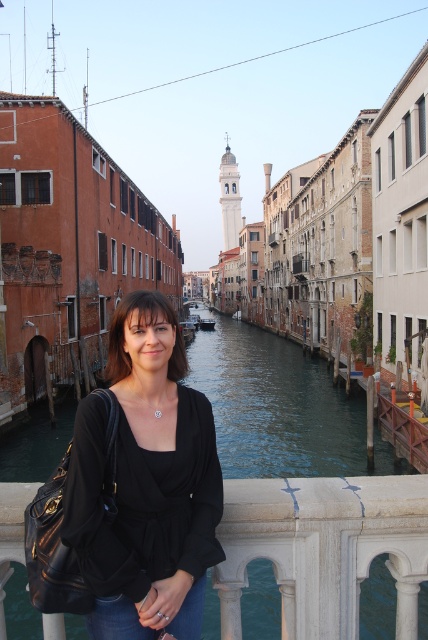
Does black matte shirt at center have a lesser height compared to jeans at lower center?

In fact, black matte shirt at center may be taller than jeans at lower center.

What do you see at coordinates (145, 483) in the screenshot? This screenshot has width=428, height=640. I see `black matte shirt at center` at bounding box center [145, 483].

Where is `black matte shirt at center`? black matte shirt at center is located at coordinates (145, 483).

Does greenish water at center have a lesser width compared to jeans at lower center?

Incorrect, greenish water at center's width is not less than jeans at lower center's.

Does point (258, 448) lie in front of point (106, 637)?

That is False.

You are a GUI agent. You are given a task and a screenshot of the screen. Output one action in this format:
    pyautogui.click(x=<x>, y=<y>)
    Task: Click on the greenish water at center
    The height and width of the screenshot is (640, 428).
    Given the screenshot: What is the action you would take?
    pyautogui.click(x=275, y=406)

Can you confirm if black matte shirt at center is positioned to the right of greenish water at center?

In fact, black matte shirt at center is to the left of greenish water at center.

Can you confirm if black matte shirt at center is shorter than greenish water at center?

Yes, black matte shirt at center is shorter than greenish water at center.

At what (x,y) coordinates should I click in order to perform the action: click on black matte shirt at center. Please return your answer as a coordinate pair (x, y). The image size is (428, 640). Looking at the image, I should click on (145, 483).